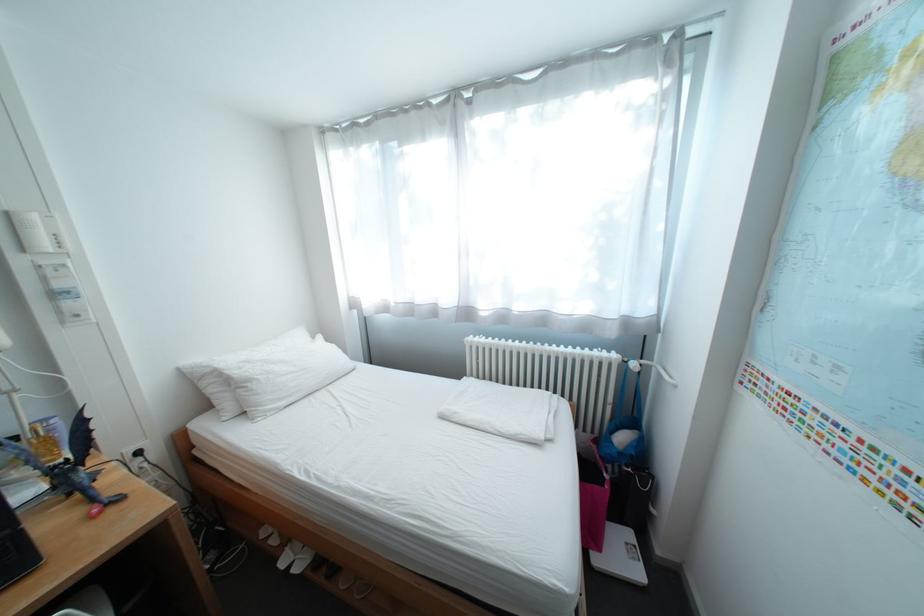
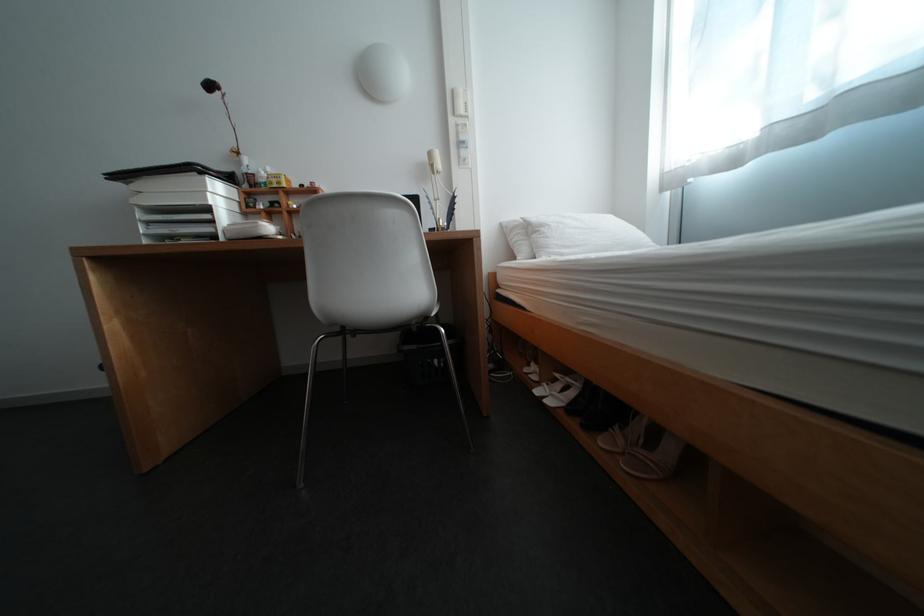
Question: The camera is either moving clockwise (left) or counter-clockwise (right) around the object. The first image is from the beginning of the video and the second image is from the end. Is the camera moving left or right when shooting the video?

Choices:
 (A) Left
 (B) Right

Answer: (B)